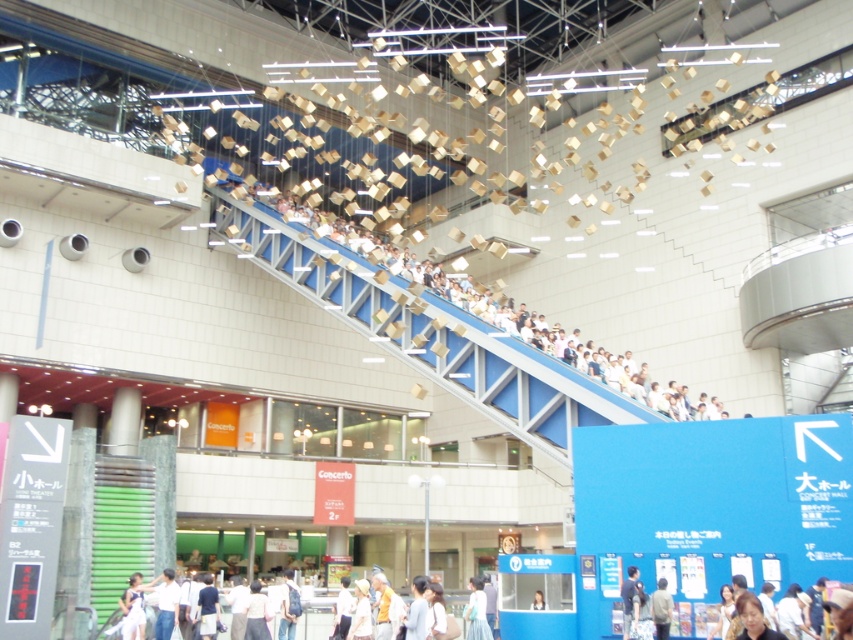
You are a maintenance worker with a ladder that is 3.5 meters tall. You need to reach the light brown hair at upper center from the light blue fabric at lower center. Can your ladder reach that height?

The distance between the light blue fabric at lower center and the light brown hair at upper center is 4.08 meters. Since the ladder is only 3.5 meters tall, it cannot reach the required height.

You are standing in the convention center and see the matte black hair at lower right and the light blue shirt at upper center. Which object is nearer to you?

The matte black hair at lower right is closer to the viewer than the light blue shirt at upper center.

You are standing in the convention center and see the light blue fabric at lower center and the light brown hair at upper center. Which object is closer to you?

The light blue fabric at lower center is closer to you because it is further to the viewer than the light brown hair at upper center.